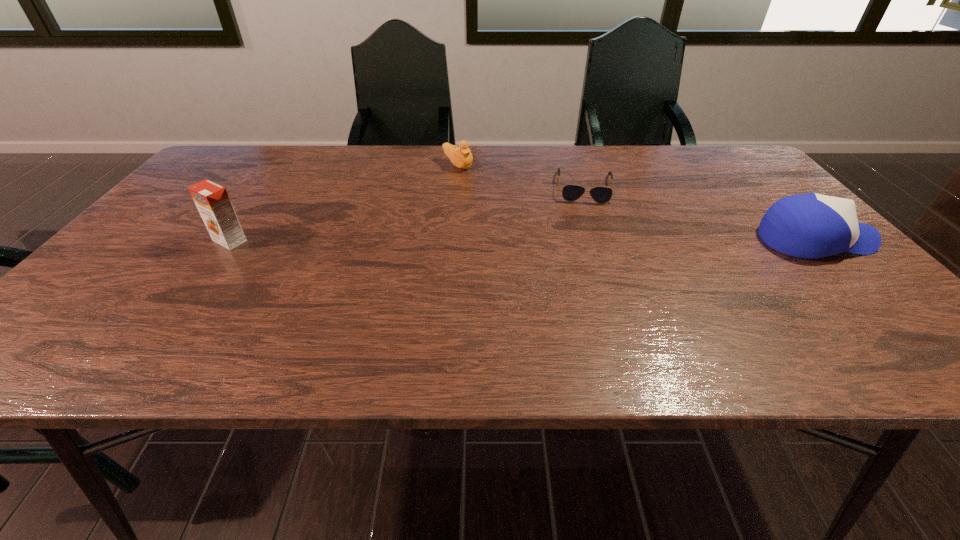
Locate an element on the screen. The height and width of the screenshot is (540, 960). vacant space positioned 0.070m on the face of the second shortest object is located at coordinates (484, 179).

You are a GUI agent. You are given a task and a screenshot of the screen. Output one action in this format:
    pyautogui.click(x=<x>, y=<y>)
    Task: Click on the vacant space located on the face of the second shortest object
    The height and width of the screenshot is (540, 960).
    Given the screenshot: What is the action you would take?
    pyautogui.click(x=558, y=219)

Find the location of a particular element. This screenshot has height=540, width=960. blank space located on the front-facing side of the shortest object is located at coordinates (592, 282).

Locate an element on the screen. The height and width of the screenshot is (540, 960). free space located on the front-facing side of the shortest object is located at coordinates (589, 246).

You are a GUI agent. You are given a task and a screenshot of the screen. Output one action in this format:
    pyautogui.click(x=<x>, y=<y>)
    Task: Click on the vacant space located on the front-facing side of the shortest object
    The width and height of the screenshot is (960, 540).
    Given the screenshot: What is the action you would take?
    pyautogui.click(x=594, y=308)

You are a GUI agent. You are given a task and a screenshot of the screen. Output one action in this format:
    pyautogui.click(x=<x>, y=<y>)
    Task: Click on the duckling positioned at the far edge
    This screenshot has height=540, width=960.
    Given the screenshot: What is the action you would take?
    click(461, 157)

Identify the location of sunglasses at the far edge. (600, 194).

This screenshot has height=540, width=960. I want to click on object that is at the right edge, so click(812, 225).

In the image, there is a desktop. At what (x,y) coordinates should I click in order to perform the action: click on free space at the far edge. Please return your answer as a coordinate pair (x, y). Looking at the image, I should click on (612, 154).

This screenshot has height=540, width=960. In the image, there is a desktop. Identify the location of blank space at the near edge. (512, 298).